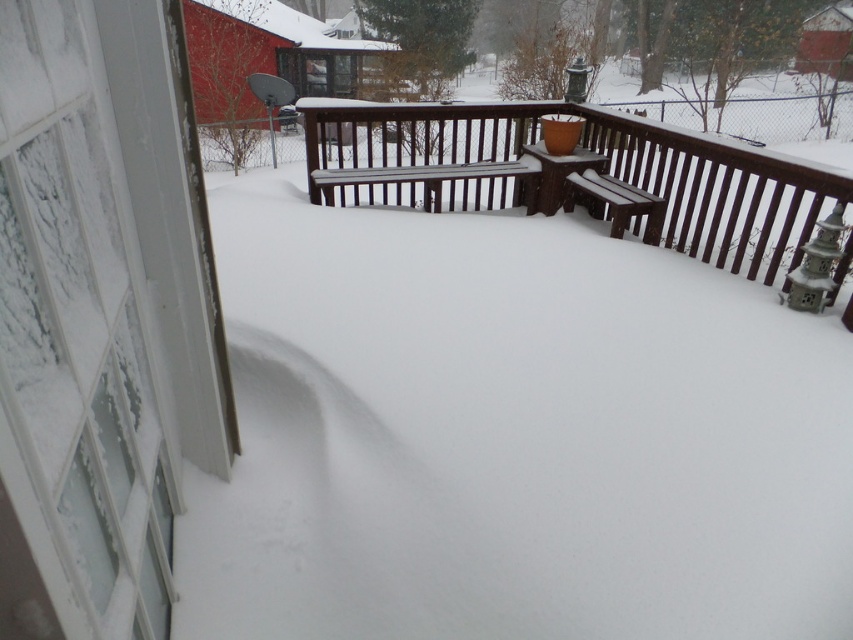
Does brown wood bench at center come behind brown wooden bench at right?

That is False.

Which is more to the left, brown wood bench at center or brown wooden bench at right?

Positioned to the left is brown wood bench at center.

Is point (496, 118) more distant than point (616, 188)?

Yes.

Where is `brown wood bench at center`? Image resolution: width=853 pixels, height=640 pixels. brown wood bench at center is located at coordinates (575, 173).